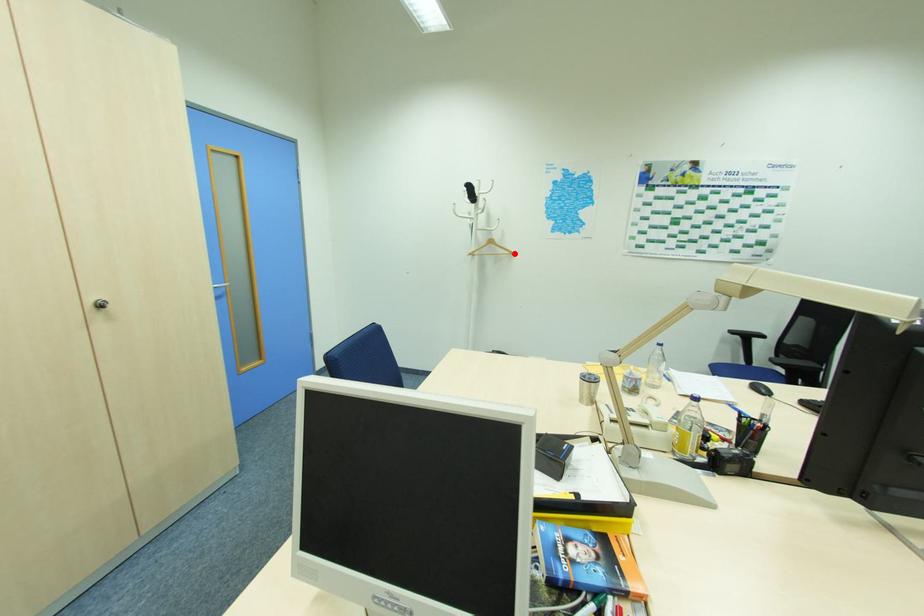
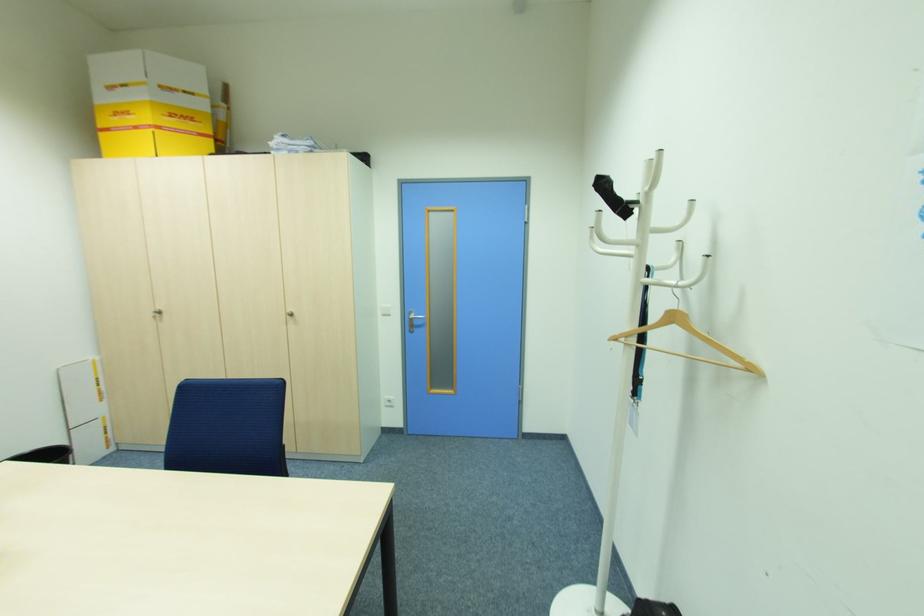
In the second image, find the point that corresponds to the highlighted location in the first image.

(756, 370)